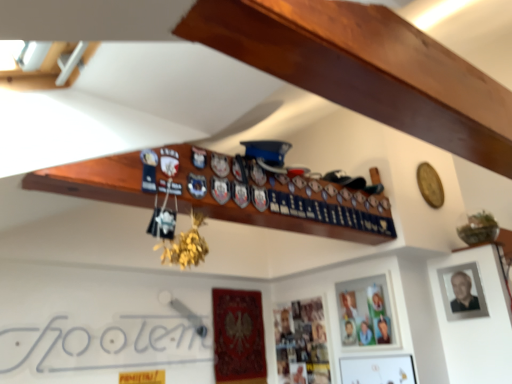
Question: Which direction should I rotate to face matte wooden picture frame at center, which is the second picture frame from left to right, — up or down?

Choices:
 (A) up
 (B) down

Answer: (B)

Question: Is the position of white paper at lower left more distant than that of metallic silver photo frame at lower center, which ranks as the third picture frame in right-to-left order?

Choices:
 (A) no
 (B) yes

Answer: (A)

Question: Is white paper at lower left facing towards metallic silver photo frame at lower center, positioned as the first picture frame in left-to-right order?

Choices:
 (A) no
 (B) yes

Answer: (A)

Question: Does white paper at lower left have a lesser width compared to metallic silver photo frame at lower center, which ranks as the third picture frame in right-to-left order?

Choices:
 (A) yes
 (B) no

Answer: (A)

Question: From a real-world perspective, is white paper at lower left beneath metallic silver photo frame at lower center, positioned as the first picture frame in left-to-right order?

Choices:
 (A) no
 (B) yes

Answer: (A)

Question: Is white paper at lower left located outside metallic silver photo frame at lower center, which ranks as the third picture frame in right-to-left order?

Choices:
 (A) no
 (B) yes

Answer: (B)

Question: Does white paper at lower left have a lesser height compared to metallic silver photo frame at lower center, which ranks as the third picture frame in right-to-left order?

Choices:
 (A) yes
 (B) no

Answer: (A)

Question: Is matte wooden picture frame at center, the 2th picture frame in the right-to-left sequence, positioned with its back to matte black photo frame at upper right, acting as the 3th picture frame starting from the left?

Choices:
 (A) no
 (B) yes

Answer: (A)

Question: Is matte wooden picture frame at center, the 2th picture frame in the right-to-left sequence, oriented towards matte black photo frame at upper right, acting as the 3th picture frame starting from the left?

Choices:
 (A) yes
 (B) no

Answer: (B)

Question: Is matte wooden picture frame at center, the 2th picture frame in the right-to-left sequence, shorter than matte black photo frame at upper right, arranged as the first picture frame when viewed from the right?

Choices:
 (A) yes
 (B) no

Answer: (B)

Question: Is matte wooden picture frame at center, which is the second picture frame from left to right, in front of matte black photo frame at upper right, acting as the 3th picture frame starting from the left?

Choices:
 (A) yes
 (B) no

Answer: (B)

Question: Is matte wooden picture frame at center, the 2th picture frame in the right-to-left sequence, in contact with matte black photo frame at upper right, acting as the 3th picture frame starting from the left?

Choices:
 (A) yes
 (B) no

Answer: (B)

Question: Is matte wooden picture frame at center, which is the second picture frame from left to right, not inside matte black photo frame at upper right, acting as the 3th picture frame starting from the left?

Choices:
 (A) no
 (B) yes

Answer: (B)

Question: Is white paper at lower left thinner than matte wooden picture frame at center, the 2th picture frame in the right-to-left sequence?

Choices:
 (A) no
 (B) yes

Answer: (B)